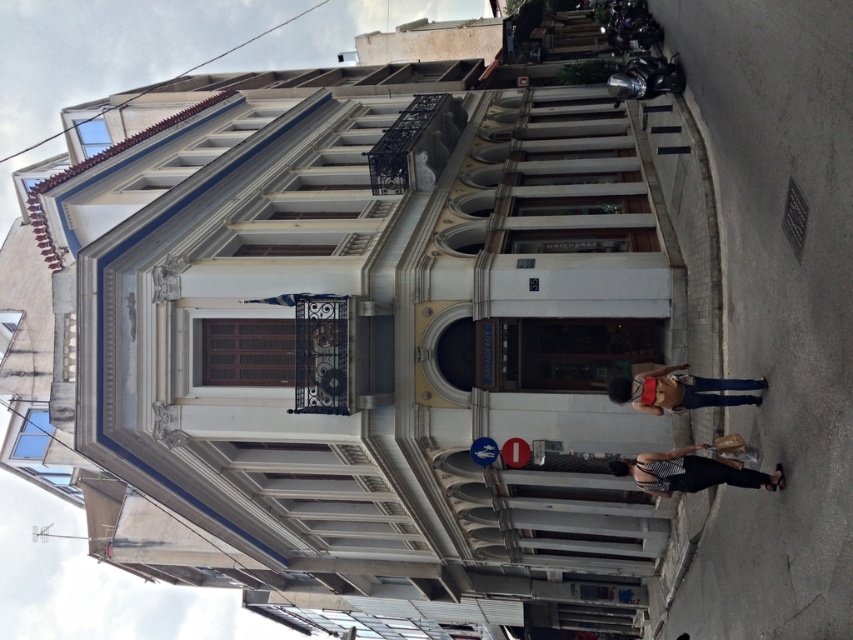
Is striped fabric dress at lower center taller than denim jeans at lower right?

No.

Between striped fabric dress at lower center and denim jeans at lower right, which one appears on the left side from the viewer's perspective?

denim jeans at lower right

Is point (715, 467) farther from viewer compared to point (759, 403)?

No, (715, 467) is in front of (759, 403).

I want to click on striped fabric dress at lower center, so click(x=691, y=472).